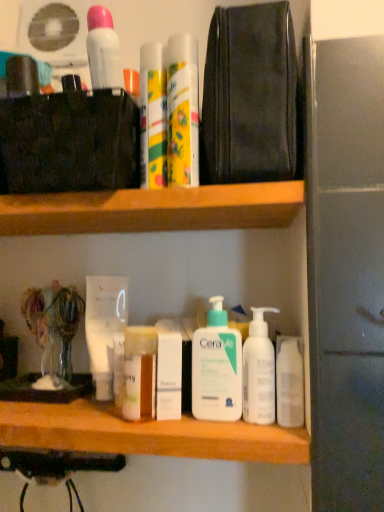
Where is `free space to the left of white pump bottle at center, which is counted as the first cleaning product, starting from the left`? Image resolution: width=384 pixels, height=512 pixels. free space to the left of white pump bottle at center, which is counted as the first cleaning product, starting from the left is located at coordinates (102, 417).